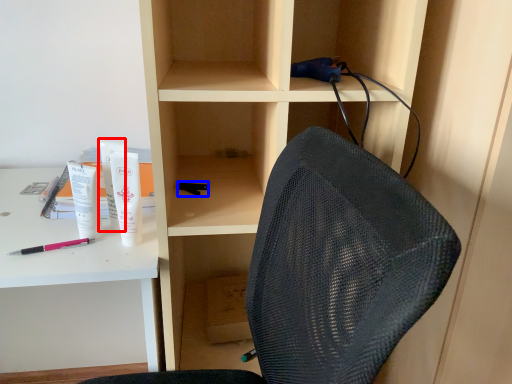
Question: Which of the following is the farthest to the observer, stationery (highlighted by a red box) or stationery (highlighted by a blue box)?

Choices:
 (A) stationery
 (B) stationery

Answer: (B)